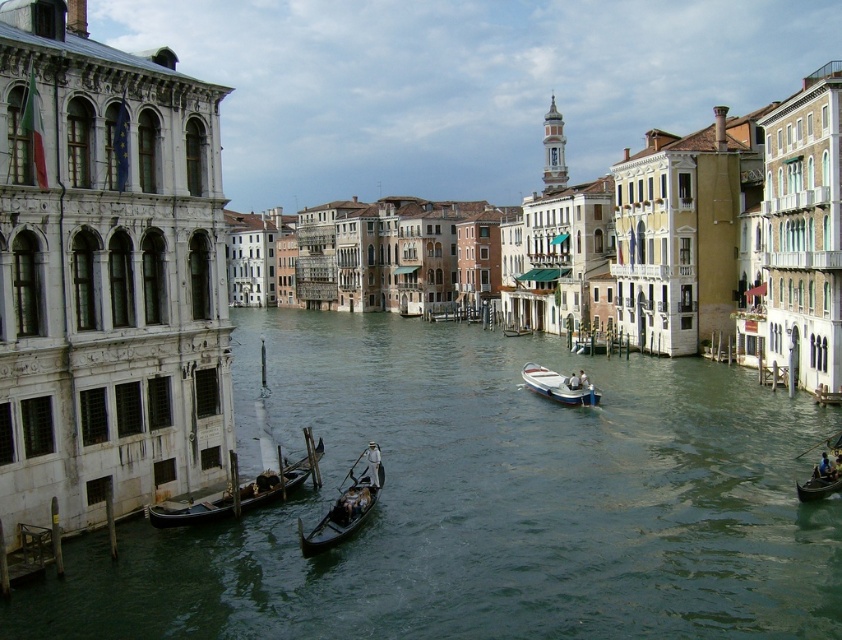
You are planning to navigate a narrow bridge that can only accommodate boats with a width of 1.2 meters. You see the black polished wood gondola at center and the white plastic boat at center in the canal. Which boat should you choose to pass under the bridge safely?

The black polished wood gondola at center has a lesser width compared to the white plastic boat at center, so you should choose the black polished wood gondola at center to pass under the narrow bridge safely since it is narrower than the 1.2 meters limit.

You are a tourist standing on the bridge above the canal. You want to take a photo of the black polished wood gondola at center and the greenish water at center. Which object will appear wider in your photo?

The greenish water at center will appear wider in your photo because its width is larger than that of the black polished wood gondola at center.

You are a tourist standing on the canal bridge and want to take a photo of both gondolas. Which gondola is shorter in height between the black polished gondola at lower left and the black polished wood gondola at center?

The black polished gondola at lower left is shorter in height compared to the black polished wood gondola at center.